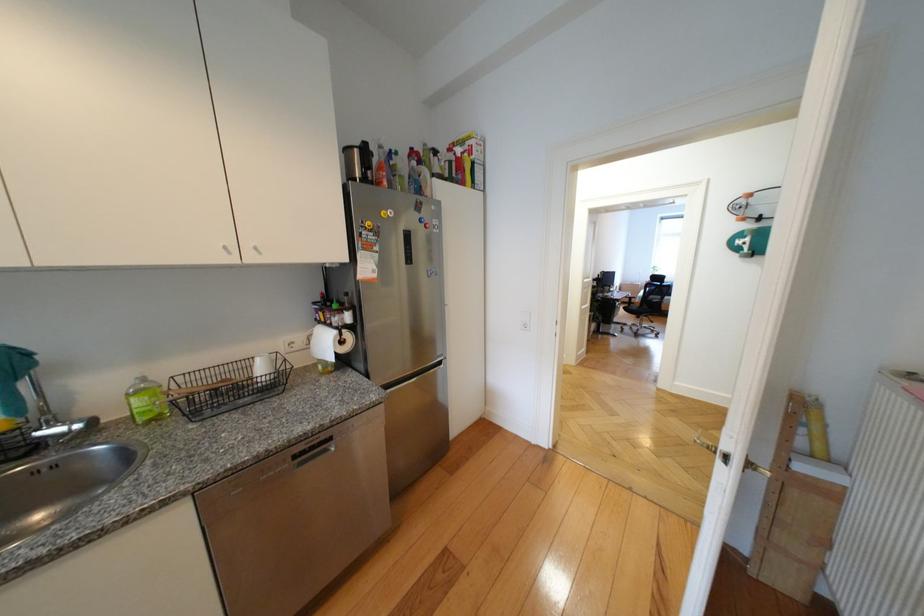
Describe the element at coordinates (702, 440) in the screenshot. I see `the brass door handle` at that location.